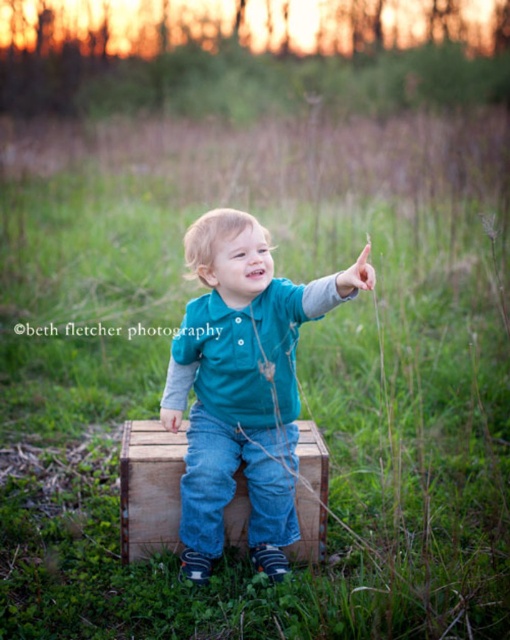
Question: Is teal fabric shirt at center closer to the viewer compared to wooden crate at center?

Choices:
 (A) no
 (B) yes

Answer: (B)

Question: In this image, where is teal fabric shirt at center located relative to wooden crate at center?

Choices:
 (A) above
 (B) below

Answer: (A)

Question: Which point is closer to the camera taking this photo?

Choices:
 (A) (153, 458)
 (B) (198, 529)

Answer: (B)

Question: Is teal fabric shirt at center in front of wooden crate at center?

Choices:
 (A) no
 (B) yes

Answer: (B)

Question: Which point is farther to the camera?

Choices:
 (A) (124, 500)
 (B) (265, 252)

Answer: (A)